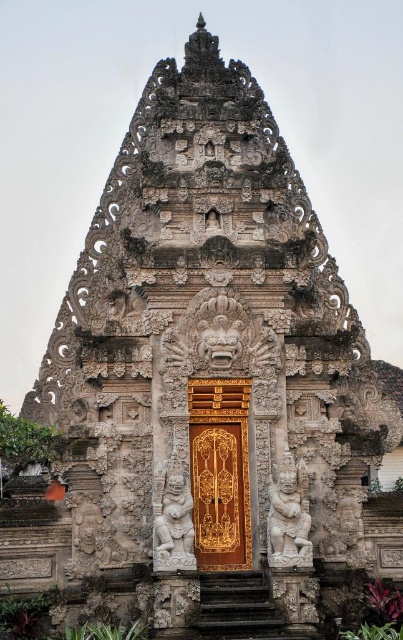
Question: Does gold polished wood door at center appear over white stone deity at lower center?

Choices:
 (A) no
 (B) yes

Answer: (A)

Question: Is dark gray stone stairs at center thinner than white stone deity at lower center?

Choices:
 (A) no
 (B) yes

Answer: (A)

Question: Which object is the farthest from the white stone deity at lower center?

Choices:
 (A) dark gray stone stairs at center
 (B) gold polished wood door at center

Answer: (A)

Question: Which is farther from the gold polished wood door at center?

Choices:
 (A) white stone deity at center
 (B) white stone deity at lower center

Answer: (B)

Question: Is gold polished wood door at center to the left of white stone deity at lower center from the viewer's perspective?

Choices:
 (A) yes
 (B) no

Answer: (A)

Question: Which object is farther from the camera taking this photo?

Choices:
 (A) white stone deity at center
 (B) gold polished wood door at center
 (C) white stone deity at lower center

Answer: (B)